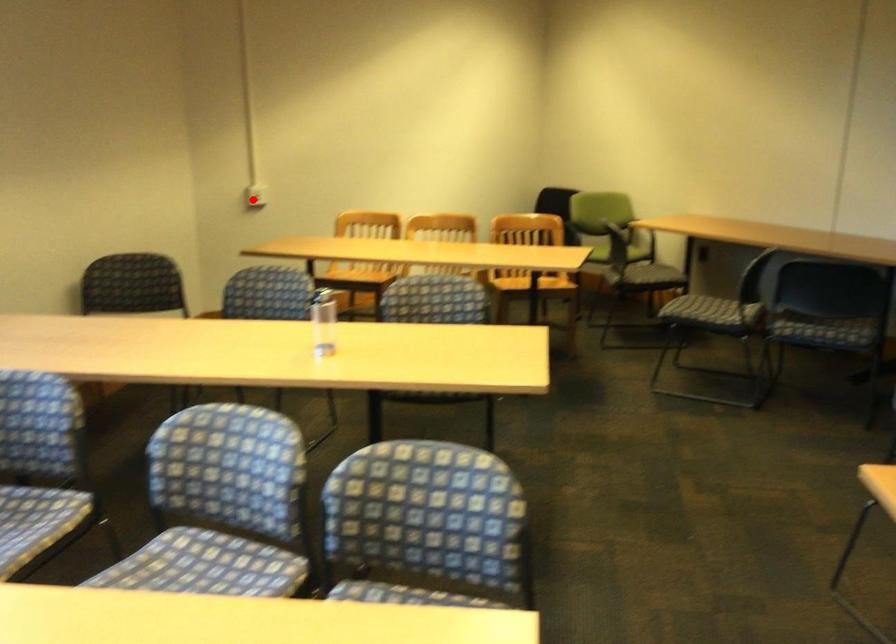
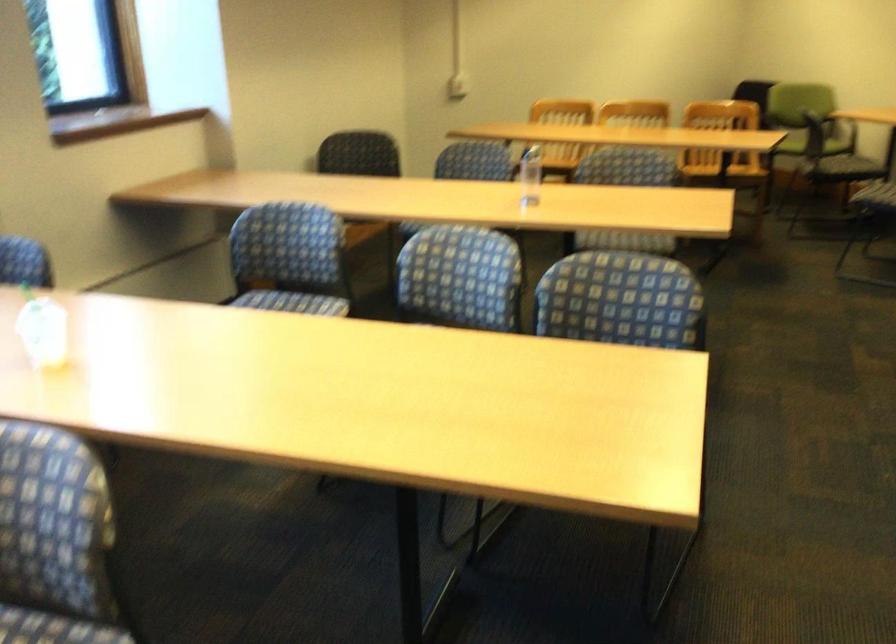
Where in the second image is the point corresponding to the highlighted location from the first image?

(458, 86)